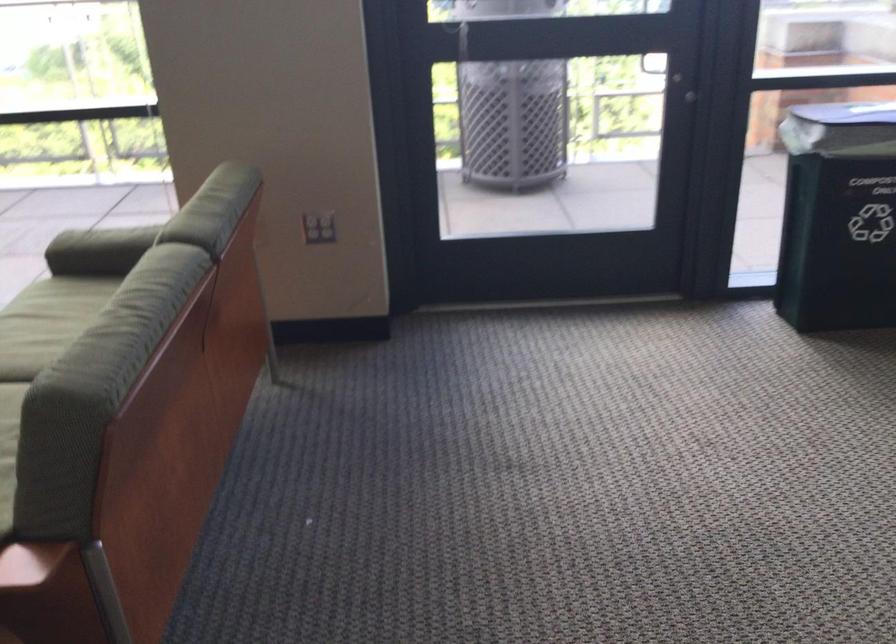
The image size is (896, 644). Describe the element at coordinates (848, 118) in the screenshot. I see `the compost bin opening` at that location.